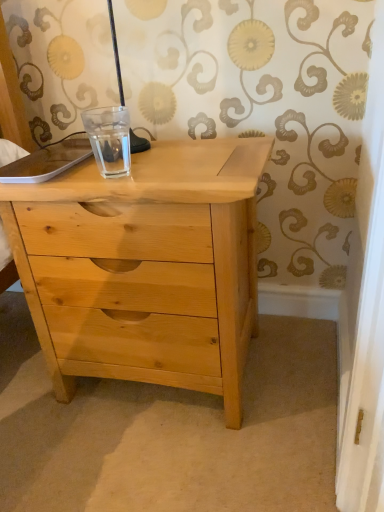
Find the location of a particular element. The width and height of the screenshot is (384, 512). clear glass cup at center is located at coordinates (109, 139).

Image resolution: width=384 pixels, height=512 pixels. What do you see at coordinates (109, 139) in the screenshot? I see `clear glass cup at center` at bounding box center [109, 139].

From the picture: What is the approximate width of clear glass cup at center?

The width of clear glass cup at center is 3.66 inches.

Describe the element at coordinates (161, 256) in the screenshot. Image resolution: width=384 pixels, height=512 pixels. I see `natural wood chest of drawers at center` at that location.

Locate an element on the screen. Image resolution: width=384 pixels, height=512 pixels. natural wood chest of drawers at center is located at coordinates (161, 256).

Where is `clear glass cup at center`? clear glass cup at center is located at coordinates (109, 139).

Is clear glass cup at center to the left of natural wood chest of drawers at center from the viewer's perspective?

Correct, you'll find clear glass cup at center to the left of natural wood chest of drawers at center.

Does clear glass cup at center come in front of natural wood chest of drawers at center?

No, clear glass cup at center is further to the viewer.

Considering the positions of points (94, 139) and (49, 332), is point (94, 139) farther from camera compared to point (49, 332)?

Yes, point (94, 139) is farther from viewer.

From the image's perspective, which is below, clear glass cup at center or natural wood chest of drawers at center?

natural wood chest of drawers at center, from the image's perspective.

From a real-world perspective, which is physically above, clear glass cup at center or natural wood chest of drawers at center?

clear glass cup at center, from a real-world perspective.

Is clear glass cup at center wider or thinner than natural wood chest of drawers at center?

Clearly, clear glass cup at center has less width compared to natural wood chest of drawers at center.

From their relative heights in the image, would you say clear glass cup at center is taller or shorter than natural wood chest of drawers at center?

Clearly, clear glass cup at center is shorter compared to natural wood chest of drawers at center.

Is clear glass cup at center smaller than natural wood chest of drawers at center?

Indeed, clear glass cup at center has a smaller size compared to natural wood chest of drawers at center.

Is clear glass cup at center surrounding natural wood chest of drawers at center?

No, clear glass cup at center does not contain natural wood chest of drawers at center.

Is clear glass cup at center directly adjacent to natural wood chest of drawers at center?

No, clear glass cup at center is not with natural wood chest of drawers at center.

Is natural wood chest of drawers at center at the back of clear glass cup at center?

No, natural wood chest of drawers at center is not at the back of clear glass cup at center.

Can you tell me how much clear glass cup at center and natural wood chest of drawers at center differ in facing direction?

The facing directions of clear glass cup at center and natural wood chest of drawers at center are 2.97 degrees apart.

Locate an element on the screen. The image size is (384, 512). glass jar above the natural wood chest of drawers at center (from a real-world perspective) is located at coordinates (109, 139).

Based on their positions, is natural wood chest of drawers at center located to the left or right of clear glass cup at center?

From the image, it's evident that natural wood chest of drawers at center is to the right of clear glass cup at center.

Which object is further away from the camera, natural wood chest of drawers at center or clear glass cup at center?

clear glass cup at center is further from the camera.

Does point (249, 300) lie in front of point (103, 127)?

Yes.

From the image's perspective, is natural wood chest of drawers at center located above or below clear glass cup at center?

Based on their image positions, natural wood chest of drawers at center is located beneath clear glass cup at center.

From a real-world perspective, is natural wood chest of drawers at center below clear glass cup at center?

Indeed, from a real-world perspective, natural wood chest of drawers at center is positioned beneath clear glass cup at center.

Does natural wood chest of drawers at center have a greater width compared to clear glass cup at center?

Yes, natural wood chest of drawers at center is wider than clear glass cup at center.

Considering the relative sizes of natural wood chest of drawers at center and clear glass cup at center in the image provided, is natural wood chest of drawers at center shorter than clear glass cup at center?

Incorrect, the height of natural wood chest of drawers at center does not fall short of that of clear glass cup at center.

From the picture: Is natural wood chest of drawers at center bigger than clear glass cup at center?

Correct, natural wood chest of drawers at center is larger in size than clear glass cup at center.

Is natural wood chest of drawers at center inside the boundaries of clear glass cup at center, or outside?

natural wood chest of drawers at center is outside clear glass cup at center.

Is there a large distance between natural wood chest of drawers at center and clear glass cup at center?

Actually, natural wood chest of drawers at center and clear glass cup at center are a little close together.

Is natural wood chest of drawers at center aimed at clear glass cup at center?

No, natural wood chest of drawers at center is not aimed at clear glass cup at center.

How many degrees apart are the facing directions of natural wood chest of drawers at center and clear glass cup at center?

2.97 degrees.

Locate an element on the screen. This screenshot has height=512, width=384. glass jar behind the natural wood chest of drawers at center is located at coordinates (109, 139).

Find the location of `the chest of drawers lying in front of the clear glass cup at center`. the chest of drawers lying in front of the clear glass cup at center is located at coordinates (161, 256).

Locate an element on the screen. Image resolution: width=384 pixels, height=512 pixels. glass jar that appears above the natural wood chest of drawers at center (from the image's perspective) is located at coordinates (109, 139).